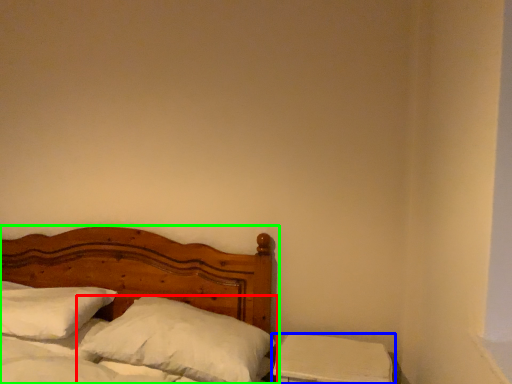
Question: Based on their relative distances, which object is farther from pillow (highlighted by a red box)? Choose from nightstand (highlighted by a blue box) and bed (highlighted by a green box).

Choices:
 (A) nightstand
 (B) bed

Answer: (B)